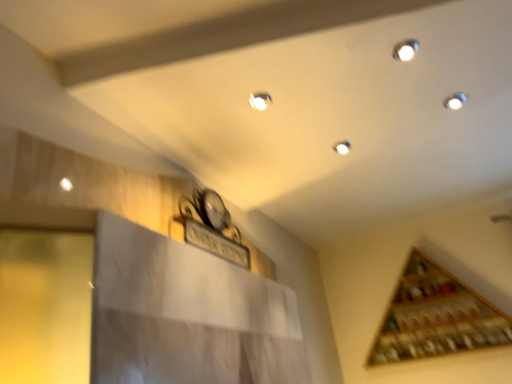
Question: Is wooden wine rack at upper right wider or thinner than matte white light at upper center?

Choices:
 (A) thin
 (B) wide

Answer: (B)

Question: Considering the relative positions of wooden wine rack at upper right and matte white light at upper center in the image provided, is wooden wine rack at upper right to the left or to the right of matte white light at upper center?

Choices:
 (A) right
 (B) left

Answer: (A)

Question: In terms of size, does wooden wine rack at upper right appear bigger or smaller than matte white light at upper center?

Choices:
 (A) small
 (B) big

Answer: (B)

Question: From the image's perspective, is matte white light at upper center located above or below wooden wine rack at upper right?

Choices:
 (A) above
 (B) below

Answer: (A)

Question: Considering the positions of point (252, 99) and point (446, 342), is point (252, 99) closer or farther from the camera than point (446, 342)?

Choices:
 (A) farther
 (B) closer

Answer: (B)

Question: Is matte white light at upper center in front of or behind wooden wine rack at upper right in the image?

Choices:
 (A) behind
 (B) front

Answer: (B)

Question: In terms of width, does matte white light at upper center look wider or thinner when compared to wooden wine rack at upper right?

Choices:
 (A) wide
 (B) thin

Answer: (B)